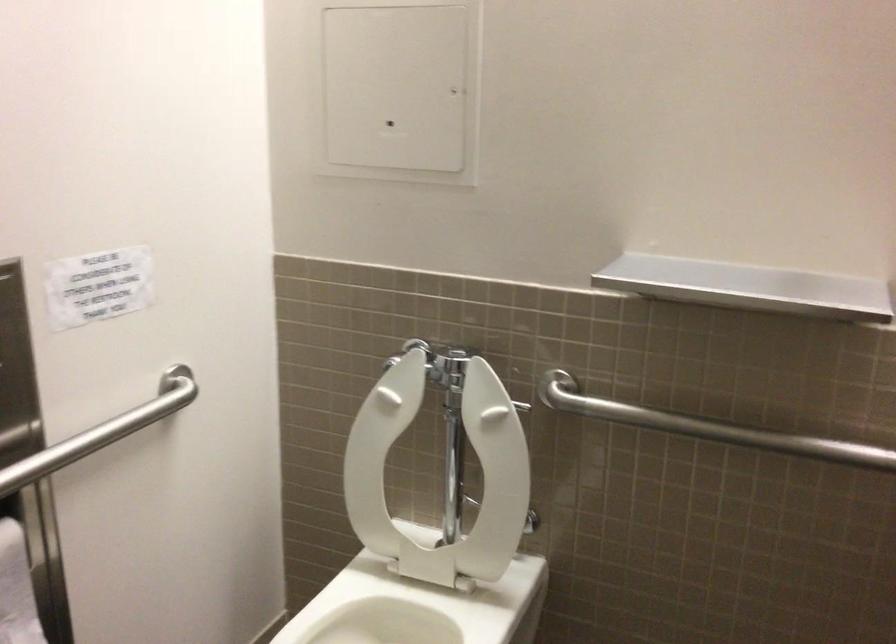
Locate an element on the screen. This screenshot has width=896, height=644. panel lock is located at coordinates (391, 126).